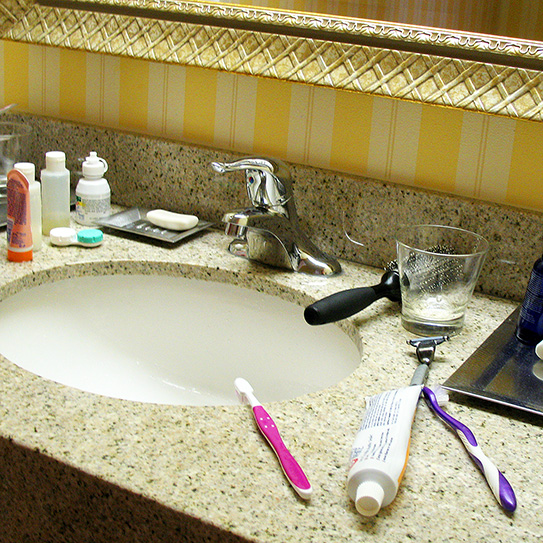
Identify the location of glass tumbler. (432, 299).